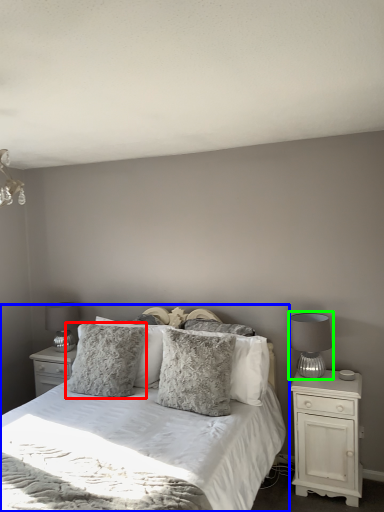
Question: Which object is positioned farthest from pillow (highlighted by a red box)? Select from bed (highlighted by a blue box) and table lamp (highlighted by a green box).

Choices:
 (A) bed
 (B) table lamp

Answer: (B)